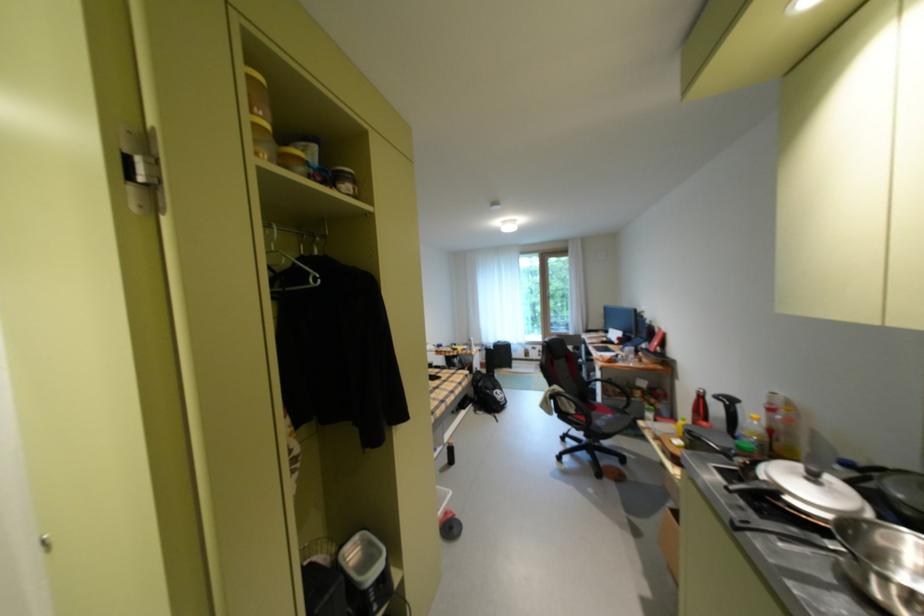
Find where to lift the black backpack. Please return your answer as a coordinate pair (x, y).

(488, 392)